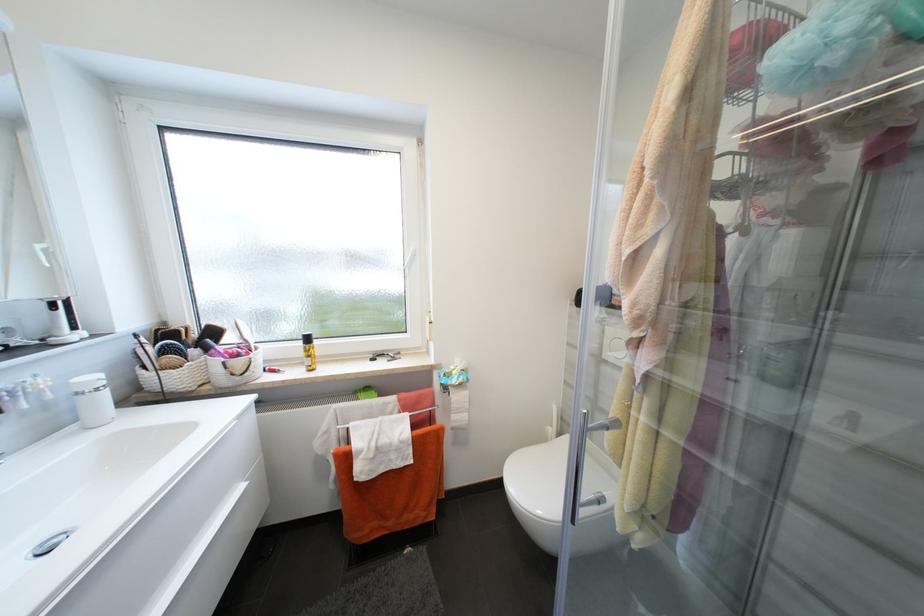
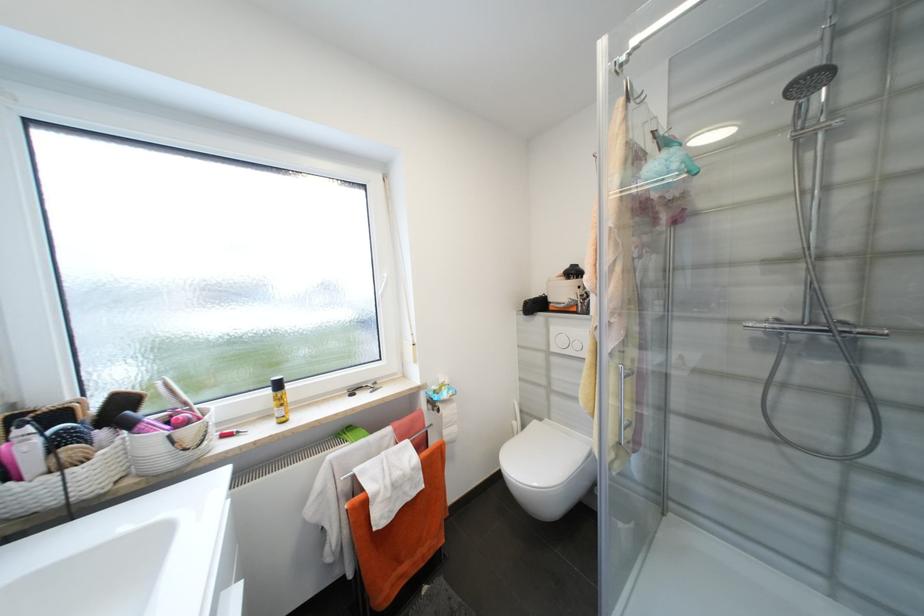
The point at (313, 341) is marked in the first image. Where is the corresponding point in the second image?

(284, 386)